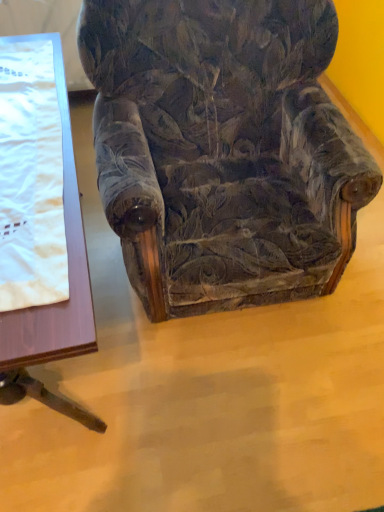
What do you see at coordinates (223, 149) in the screenshot?
I see `velvet floral-patterned armchair at center` at bounding box center [223, 149].

Identify the location of white satin blanket at left. This screenshot has width=384, height=512. (30, 179).

From the image's perspective, is white satin blanket at left on velvet floral-patterned armchair at center?

No, from the image's perspective, white satin blanket at left is not over velvet floral-patterned armchair at center.

Which of these two, white satin blanket at left or velvet floral-patterned armchair at center, stands shorter?

With less height is white satin blanket at left.

The height and width of the screenshot is (512, 384). I want to click on blanket below the velvet floral-patterned armchair at center (from the image's perspective), so click(x=30, y=179).

Between white satin blanket at left and velvet floral-patterned armchair at center, which one appears on the left side from the viewer's perspective?

white satin blanket at left.

From the image's perspective, relative to white satin blanket at left, is velvet floral-patterned armchair at center above or below?

Clearly, from the image's perspective, velvet floral-patterned armchair at center is above white satin blanket at left.

Considering the relative positions of velvet floral-patterned armchair at center and white satin blanket at left in the image provided, is velvet floral-patterned armchair at center to the left or to the right of white satin blanket at left?

From the image, it's evident that velvet floral-patterned armchair at center is to the right of white satin blanket at left.

Does velvet floral-patterned armchair at center have a lesser height compared to white satin blanket at left?

No, velvet floral-patterned armchair at center is not shorter than white satin blanket at left.

Do you think velvet floral-patterned armchair at center is within white satin blanket at left, or outside of it?

velvet floral-patterned armchair at center is outside white satin blanket at left.

Is white satin blanket at left taller than wooden table at left?

Incorrect, the height of white satin blanket at left is not larger of that of wooden table at left.

Is white satin blanket at left in contact with wooden table at left?

Yes, white satin blanket at left is beside wooden table at left.

Between point (57, 177) and point (55, 254), which one is positioned in front?

The point (55, 254) is closer to the camera.

From a real-world perspective, is white satin blanket at left physically above wooden table at left?

Yes, from a real-world perspective, white satin blanket at left is over wooden table at left

Which is more distant, (162,47) or (89,292)?

The point (162,47) is behind.

From the image's perspective, is velvet floral-patterned armchair at center on top of wooden table at left?

Yes, from the image's perspective, velvet floral-patterned armchair at center is over wooden table at left.

From a real-world perspective, who is located lower, velvet floral-patterned armchair at center or wooden table at left?

wooden table at left is physically lower.

The width and height of the screenshot is (384, 512). In order to click on chair above the wooden table at left (from a real-world perspective) in this screenshot , I will do `click(223, 149)`.

Between wooden table at left and white satin blanket at left, which one has more height?

wooden table at left is taller.

From the image's perspective, would you say wooden table at left is shown under white satin blanket at left?

Indeed, from the image's perspective, wooden table at left is shown beneath white satin blanket at left.

Is wooden table at left facing towards white satin blanket at left?

No, wooden table at left is not facing towards white satin blanket at left.

Is wooden table at left bigger or smaller than white satin blanket at left?

Clearly, wooden table at left is larger in size than white satin blanket at left.

Does wooden table at left have a lesser width compared to velvet floral-patterned armchair at center?

In fact, wooden table at left might be wider than velvet floral-patterned armchair at center.

Which object is closer to the camera taking this photo, wooden table at left or velvet floral-patterned armchair at center?

velvet floral-patterned armchair at center.

Is wooden table at left positioned with its back to velvet floral-patterned armchair at center?

No, wooden table at left is not facing the opposite direction of velvet floral-patterned armchair at center.

Is wooden table at left to the left of velvet floral-patterned armchair at center from the viewer's perspective?

Yes.

Where is `blanket on the left of velvet floral-patterned armchair at center`? This screenshot has height=512, width=384. blanket on the left of velvet floral-patterned armchair at center is located at coordinates (30, 179).

Locate an element on the screen. The height and width of the screenshot is (512, 384). chair in front of the white satin blanket at left is located at coordinates (223, 149).

Based on their spatial positions, is velvet floral-patterned armchair at center or white satin blanket at left closer to wooden table at left?

white satin blanket at left lies closer to wooden table at left than the other object.

From the image, which object appears to be nearer to velvet floral-patterned armchair at center, wooden table at left or white satin blanket at left?

Based on the image, wooden table at left appears to be nearer to velvet floral-patterned armchair at center.

Considering their positions, is velvet floral-patterned armchair at center positioned further to white satin blanket at left than wooden table at left?

Based on the image, velvet floral-patterned armchair at center appears to be further to white satin blanket at left.

Which object lies nearer to the anchor point white satin blanket at left, wooden table at left or velvet floral-patterned armchair at center?

wooden table at left.

In the scene shown: From the image, which object appears to be farther from velvet floral-patterned armchair at center, white satin blanket at left or wooden table at left?

white satin blanket at left is further to velvet floral-patterned armchair at center.

Based on their spatial positions, is white satin blanket at left or velvet floral-patterned armchair at center closer to wooden table at left?

white satin blanket at left is positioned closer to the anchor wooden table at left.

You are a GUI agent. You are given a task and a screenshot of the screen. Output one action in this format:
    pyautogui.click(x=<x>, y=<y>)
    Task: Click on the blanket between wooden table at left and velvet floral-patterned armchair at center from left to right
    The image size is (384, 512).
    Given the screenshot: What is the action you would take?
    pyautogui.click(x=30, y=179)